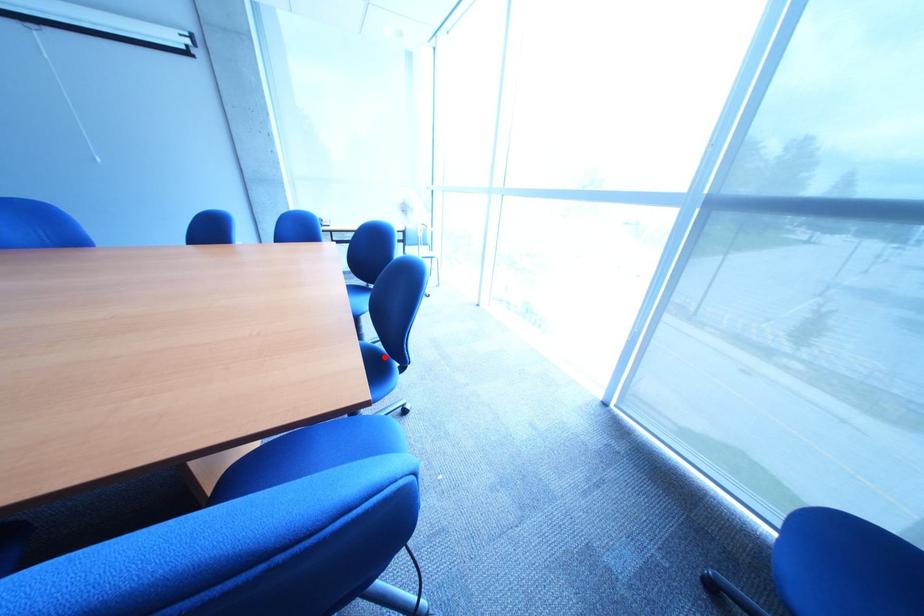
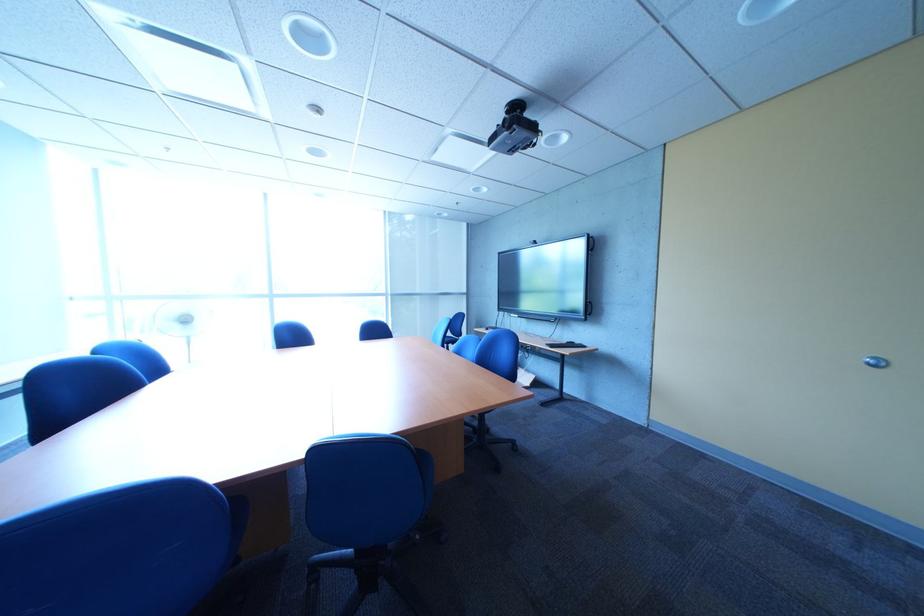
Question: I am providing you with two images of the same scene from different viewpoints. A red point is marked on the first image. At the location where the point appears in image 1, is it still visible in image 2?

Choices:
 (A) Yes
 (B) No

Answer: (B)